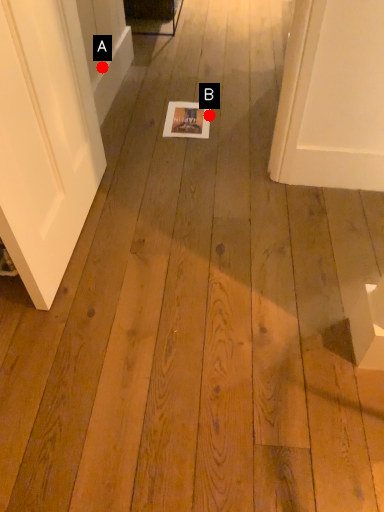
Question: Two points are circled on the image, labeled by A and B beside each circle. Which point is closer to the camera?

Choices:
 (A) A is closer
 (B) B is closer

Answer: (A)